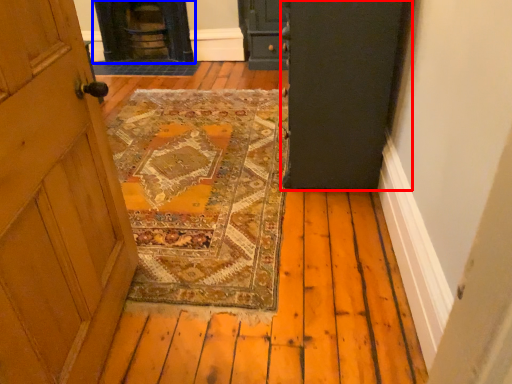
Question: Among these objects, which one is nearest to the camera, door (highlighted by a red box) or stove (highlighted by a blue box)?

Choices:
 (A) door
 (B) stove

Answer: (A)